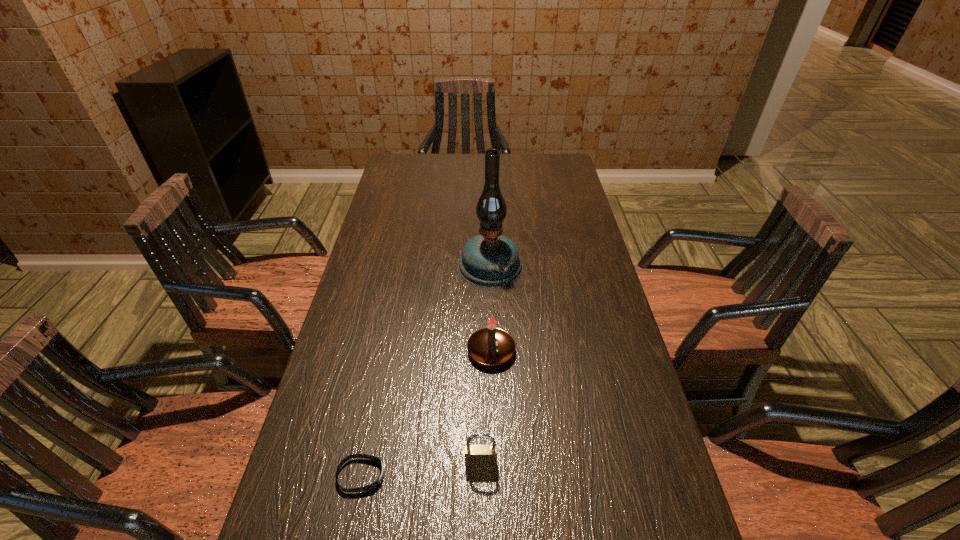
At what (x,y) coordinates should I click in order to perform the action: click on the tallest object. Please return your answer as a coordinate pair (x, y). This screenshot has width=960, height=540. Looking at the image, I should click on (490, 260).

At what (x,y) coordinates should I click in order to perform the action: click on the farthest object. Please return your answer as a coordinate pair (x, y). The height and width of the screenshot is (540, 960). Looking at the image, I should click on (490, 260).

I want to click on candle, so click(x=491, y=346).

Locate an element on the screen. This screenshot has height=540, width=960. the second shortest object is located at coordinates (479, 456).

You are a GUI agent. You are given a task and a screenshot of the screen. Output one action in this format:
    pyautogui.click(x=<x>, y=<y>)
    Task: Click on the shortest object
    This screenshot has height=540, width=960.
    Given the screenshot: What is the action you would take?
    pyautogui.click(x=372, y=486)

Where is `the leftmost object`? Image resolution: width=960 pixels, height=540 pixels. the leftmost object is located at coordinates (372, 486).

The width and height of the screenshot is (960, 540). In order to click on free point located on the left of the tallest object in this screenshot , I will do `click(387, 264)`.

At what (x,y) coordinates should I click in order to perform the action: click on free space located 0.260m on the left of the second farthest object. Please return your answer as a coordinate pair (x, y). Image resolution: width=960 pixels, height=540 pixels. Looking at the image, I should click on (364, 352).

Where is `vacant space located on the front-facing side of the second shortest object`? The width and height of the screenshot is (960, 540). vacant space located on the front-facing side of the second shortest object is located at coordinates click(x=481, y=498).

In order to click on vacant position located on the display of the wristband in this screenshot , I will do `click(575, 475)`.